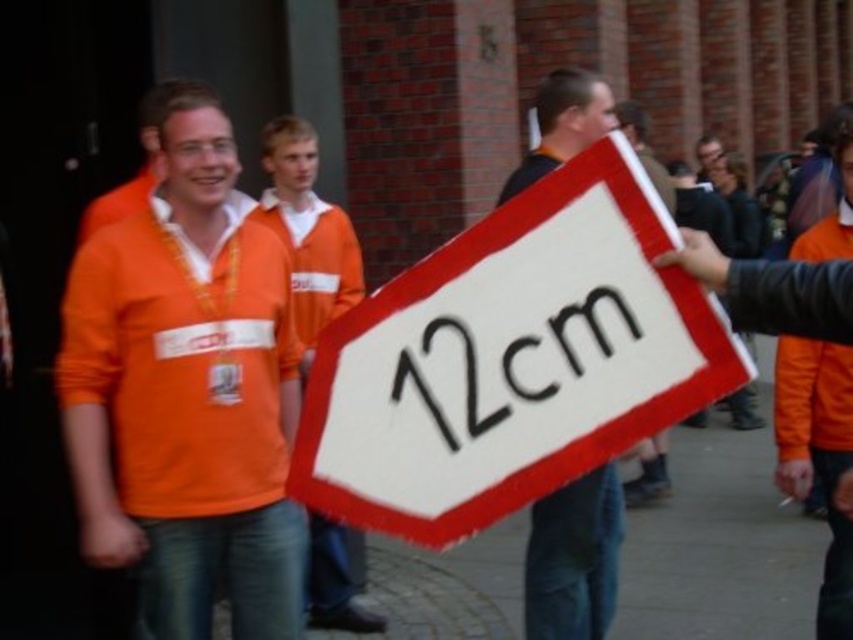
You are a participant in the event and need to place a 12cm ruler between the white felt sign at center and the white fabric sign at center. Can the ruler fit between them?

The white felt sign at center and white fabric sign at center are 36.15 inches apart. Since 36.15 inches is approximately 91.8 cm, the 12cm ruler can easily fit between them.

You are a photographer standing behind the orange jersey at center and the white fabric sign at center. You want to take a photo that clearly shows both objects. Since you can only focus on one object at a time, which object should you focus on to ensure the other remains in the background?

You should focus on the orange jersey at center because it is in front of the white fabric sign at center, so the sign will naturally be in the background when the jersey is in focus.

You are a photographer trying to capture a photo of the orange jersey at center and the white fabric sign at center. To ensure both are visible in the frame, which object should you position closer to the camera?

The orange jersey at center should be positioned closer to the camera since it is on the left side of the white fabric sign at center, allowing both to be in the frame without overlapping.